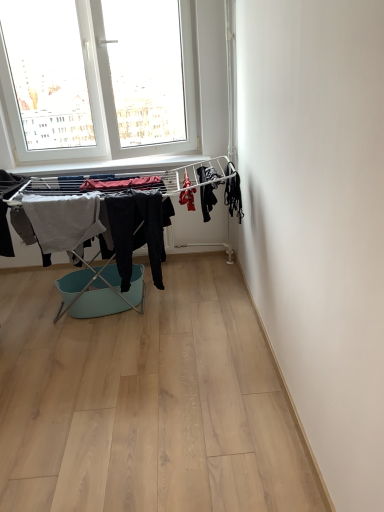
Question: Does light gray cotton towel at left, the 1th clothing when ordered from left to right, have a smaller size compared to black matte fabric at right, which ranks as the first clothing in right-to-left order?

Choices:
 (A) yes
 (B) no

Answer: (B)

Question: Can you confirm if light gray cotton towel at left, which is counted as the 5th clothing, starting from the right, is wider than black matte fabric at right, which ranks as the fifth clothing in left-to-right order?

Choices:
 (A) yes
 (B) no

Answer: (B)

Question: Is black matte fabric at right, which ranks as the first clothing in right-to-left order, surrounded by light gray cotton towel at left, which is counted as the 5th clothing, starting from the right?

Choices:
 (A) no
 (B) yes

Answer: (A)

Question: Considering the relative sizes of light gray cotton towel at left, the 1th clothing when ordered from left to right, and black matte fabric at right, which ranks as the fifth clothing in left-to-right order, in the image provided, is light gray cotton towel at left, the 1th clothing when ordered from left to right, taller than black matte fabric at right, which ranks as the fifth clothing in left-to-right order,?

Choices:
 (A) yes
 (B) no

Answer: (A)

Question: Is black matte fabric at right, which ranks as the first clothing in right-to-left order, at the back of light gray cotton towel at left, which is counted as the 5th clothing, starting from the right?

Choices:
 (A) no
 (B) yes

Answer: (A)

Question: Does point (52, 237) appear closer or farther from the camera than point (155, 228)?

Choices:
 (A) farther
 (B) closer

Answer: (B)

Question: In terms of size, does light gray cotton towel at left, which is counted as the 5th clothing, starting from the right, appear bigger or smaller than dark gray fabric pants at center, which is the second clothing in left-to-right order?

Choices:
 (A) small
 (B) big

Answer: (A)

Question: From their relative heights in the image, would you say light gray cotton towel at left, which is counted as the 5th clothing, starting from the right, is taller or shorter than dark gray fabric pants at center, which is the second clothing in left-to-right order?

Choices:
 (A) short
 (B) tall

Answer: (A)

Question: From the image's perspective, is light gray cotton towel at left, the 1th clothing when ordered from left to right, positioned above or below dark gray fabric pants at center, which is the second clothing in left-to-right order?

Choices:
 (A) below
 (B) above

Answer: (B)

Question: Which is correct: mint plastic laundry basket at center is inside light gray cotton towel at left, the 1th clothing when ordered from left to right, or outside of it?

Choices:
 (A) inside
 (B) outside

Answer: (B)

Question: Is point (105, 305) closer or farther from the camera than point (28, 203)?

Choices:
 (A) farther
 (B) closer

Answer: (A)

Question: Based on their sizes in the image, would you say mint plastic laundry basket at center is bigger or smaller than light gray cotton towel at left, which is counted as the 5th clothing, starting from the right?

Choices:
 (A) big
 (B) small

Answer: (A)

Question: In the image, is mint plastic laundry basket at center on the left side or the right side of light gray cotton towel at left, which is counted as the 5th clothing, starting from the right?

Choices:
 (A) left
 (B) right

Answer: (B)

Question: From a real-world perspective, is red fabric at center, the 3th clothing positioned from the left, physically located above or below dark gray fabric pants at center, the 4th clothing in the right-to-left sequence?

Choices:
 (A) above
 (B) below

Answer: (A)

Question: Do you think red fabric at center, which is the third clothing from right to left, is within dark gray fabric pants at center, the 4th clothing in the right-to-left sequence, or outside of it?

Choices:
 (A) inside
 (B) outside

Answer: (B)